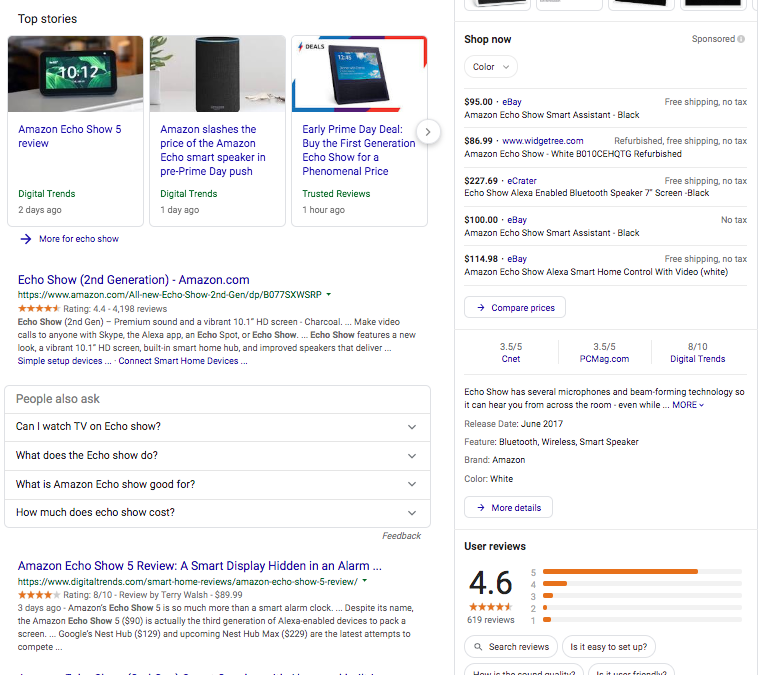
Where is `sky on screen`? sky on screen is located at coordinates (353, 63).